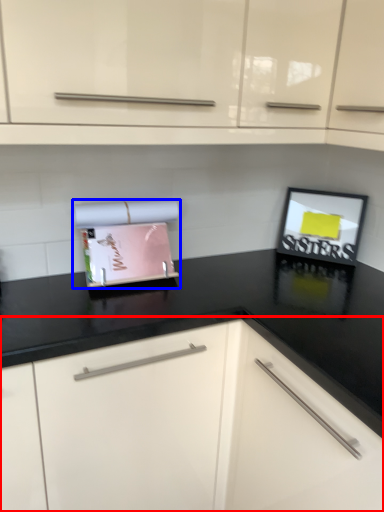
Question: Which object appears closest to the camera in this image, cabinetry (highlighted by a red box) or appliance (highlighted by a blue box)?

Choices:
 (A) cabinetry
 (B) appliance

Answer: (A)